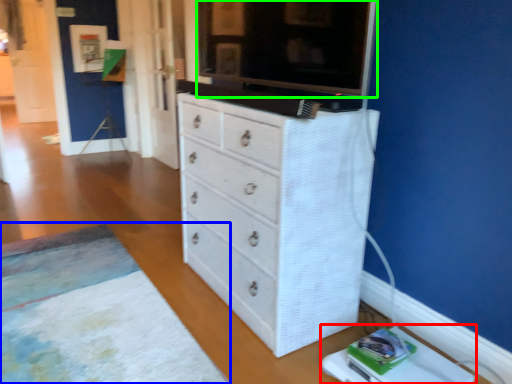
Question: Which object is positioned closest to changing table (highlighted by a red box)? Select from plain (highlighted by a blue box) and tv cabinet (highlighted by a green box).

Choices:
 (A) plain
 (B) tv cabinet

Answer: (A)